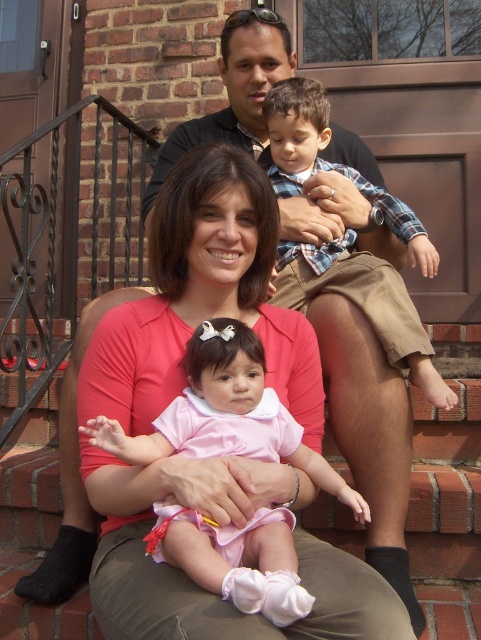
Who is taller, pink satin dress at center or plaid cotton shirt at upper right?

plaid cotton shirt at upper right is taller.

Can you confirm if pink satin dress at center is wider than plaid cotton shirt at upper right?

Indeed, pink satin dress at center has a greater width compared to plaid cotton shirt at upper right.

What do you see at coordinates (225, 413) in the screenshot?
I see `pink satin dress at center` at bounding box center [225, 413].

The height and width of the screenshot is (640, 481). I want to click on pink satin dress at center, so click(225, 413).